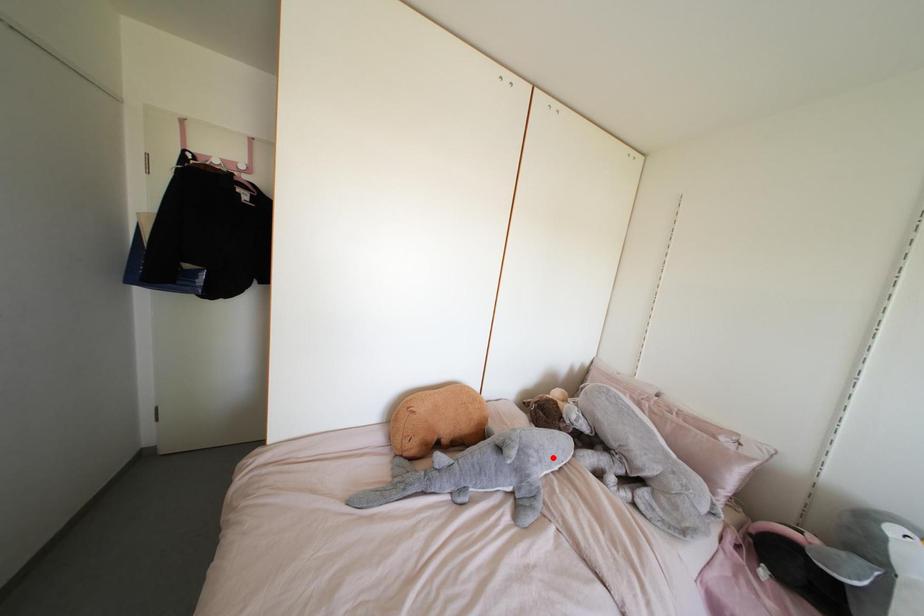
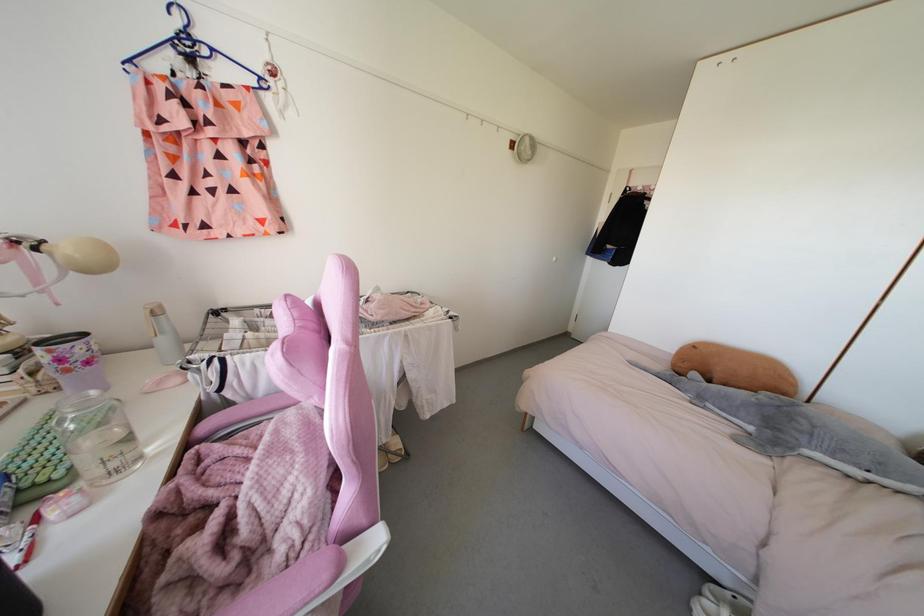
Question: I am providing you with two images of the same scene from different viewpoints. Given a red point in image1, look at the same physical point in image2. Is it:

Choices:
 (A) Closer to the viewpoint
 (B) Farther from the viewpoint

Answer: (A)